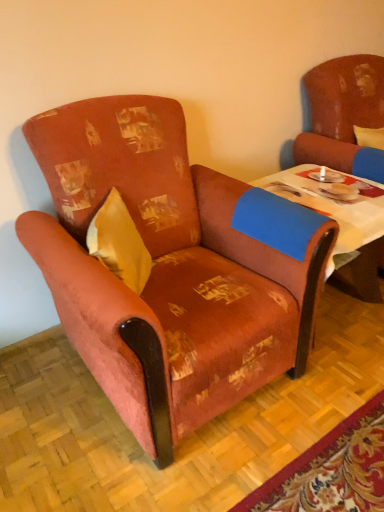
Question: From the image's perspective, is textured orange armchair at left, which is the first chair from left to right, on blue fabric table at center?

Choices:
 (A) yes
 (B) no

Answer: (B)

Question: From a real-world perspective, is textured orange armchair at left, the second chair from the right, positioned under blue fabric table at center based on gravity?

Choices:
 (A) no
 (B) yes

Answer: (A)

Question: Is textured orange armchair at left, the second chair from the right, shorter than blue fabric table at center?

Choices:
 (A) yes
 (B) no

Answer: (B)

Question: Are textured orange armchair at left, the second chair from the right, and blue fabric table at center far apart?

Choices:
 (A) no
 (B) yes

Answer: (A)

Question: Considering the relative sizes of textured orange armchair at left, which is the first chair from left to right, and blue fabric table at center in the image provided, is textured orange armchair at left, which is the first chair from left to right, wider than blue fabric table at center?

Choices:
 (A) no
 (B) yes

Answer: (B)

Question: Relative to distressed brown armchair at right, placed as the first chair when sorted from right to left, is blue fabric table at center in front or behind?

Choices:
 (A) front
 (B) behind

Answer: (A)

Question: From a real-world perspective, is blue fabric table at center positioned above or below distressed brown armchair at right, the 2th chair viewed from the left?

Choices:
 (A) above
 (B) below

Answer: (B)

Question: Looking at their shapes, would you say blue fabric table at center is wider or thinner than distressed brown armchair at right, the 2th chair viewed from the left?

Choices:
 (A) wide
 (B) thin

Answer: (A)

Question: From their relative heights in the image, would you say blue fabric table at center is taller or shorter than distressed brown armchair at right, the 2th chair viewed from the left?

Choices:
 (A) tall
 (B) short

Answer: (B)

Question: Is textured orange armchair at left, the second chair from the right, inside or outside of yellow fabric pillow at left?

Choices:
 (A) outside
 (B) inside

Answer: (A)

Question: In the image, is textured orange armchair at left, which is the first chair from left to right, positioned in front of or behind yellow fabric pillow at left?

Choices:
 (A) front
 (B) behind

Answer: (A)

Question: Based on their sizes in the image, would you say textured orange armchair at left, which is the first chair from left to right, is bigger or smaller than yellow fabric pillow at left?

Choices:
 (A) small
 (B) big

Answer: (B)

Question: From a real-world perspective, is textured orange armchair at left, the second chair from the right, physically located above or below yellow fabric pillow at left?

Choices:
 (A) below
 (B) above

Answer: (A)

Question: Is distressed brown armchair at right, placed as the first chair when sorted from right to left, in front of or behind yellow fabric pillow at left in the image?

Choices:
 (A) behind
 (B) front

Answer: (A)

Question: Would you say distressed brown armchair at right, the 2th chair viewed from the left, is to the left or to the right of yellow fabric pillow at left in the picture?

Choices:
 (A) left
 (B) right

Answer: (B)